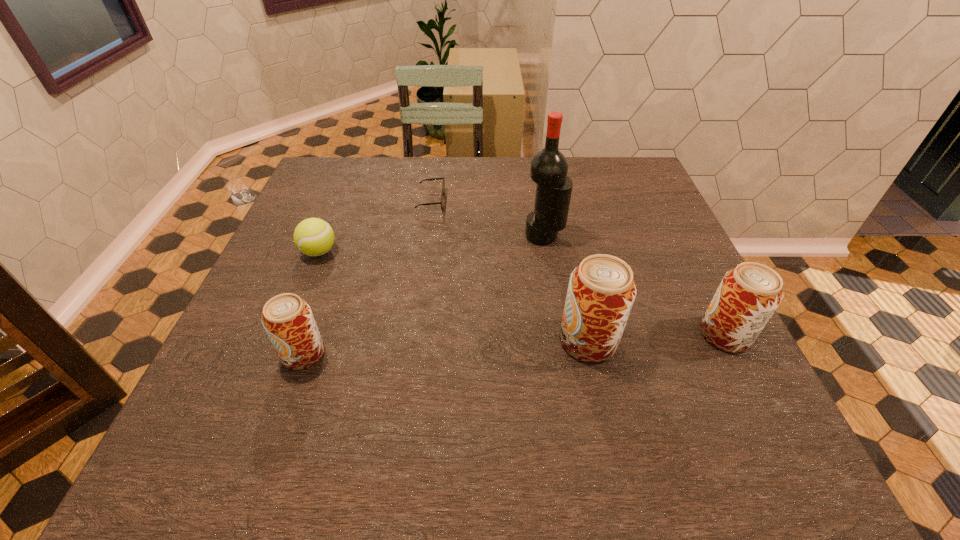
To achieve even spacing by inserting another beer_can among them, please point to a vacant spot for this new beer_can. Please provide its 2D coordinates. Your answer should be formatted as a tuple, i.e. [(x, y)], where the tuple contains the x and y coordinates of a point satisfying the conditions above.

[(447, 347)]